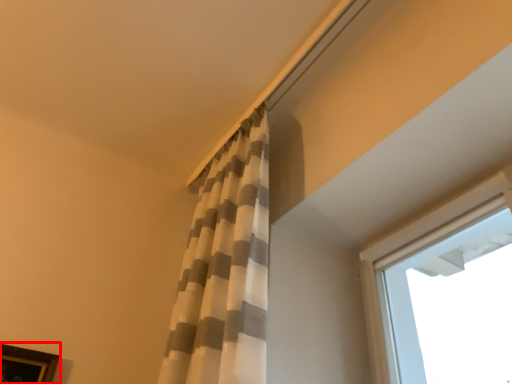
Question: In this image, where is picture frame (annotated by the red box) located relative to curtain?

Choices:
 (A) right
 (B) left

Answer: (B)